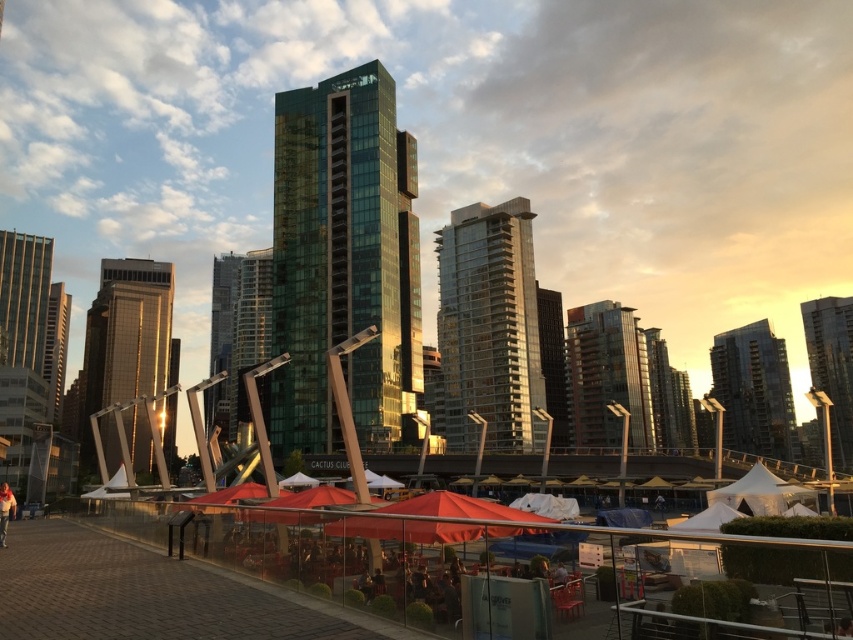
Question: Which object appears closest to the camera in this image?

Choices:
 (A) shiny silver skyscraper at center
 (B) green glass building at center
 (C) green glassy building at center

Answer: (B)

Question: Does brown glass building at center have a smaller size compared to white cotton shirt at lower left?

Choices:
 (A) no
 (B) yes

Answer: (A)

Question: Can you confirm if glassy reflective building at center is bigger than brown glass building at center?

Choices:
 (A) yes
 (B) no

Answer: (A)

Question: Which object appears farthest from the camera in this image?

Choices:
 (A) white cotton shirt at lower left
 (B) glassy reflective skyscraper at center
 (C) glassy reflective skyscraper at right

Answer: (B)

Question: Which point is farther to the camera?

Choices:
 (A) (236, 301)
 (B) (53, 369)
 (C) (843, 420)

Answer: (B)

Question: Is glassy reflective skyscraper at right thinner than glassy reflective skyscraper at center?

Choices:
 (A) yes
 (B) no

Answer: (B)